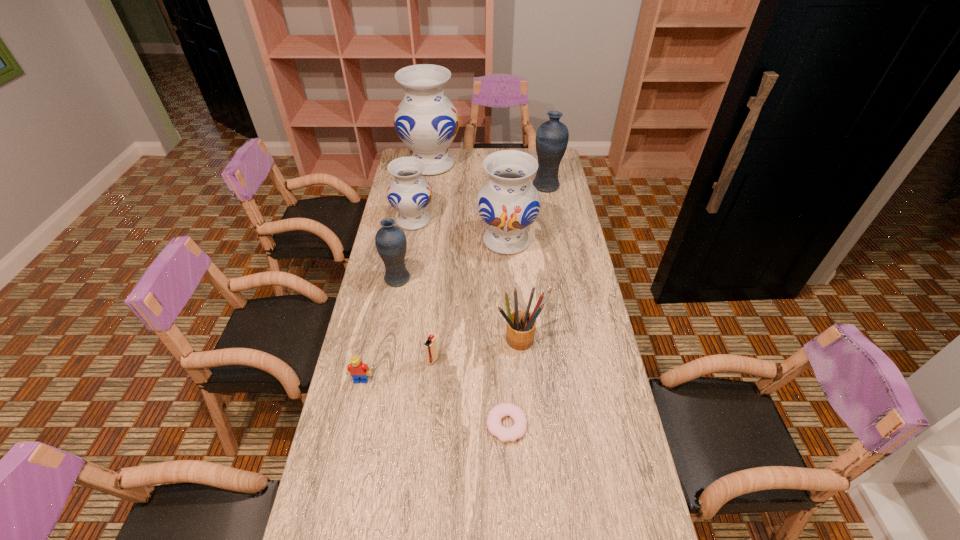
Where is `vacant region at the left edge of the desktop`? This screenshot has height=540, width=960. vacant region at the left edge of the desktop is located at coordinates (411, 255).

In the image, there is a desktop. Where is `free space at the right edge`? free space at the right edge is located at coordinates (597, 452).

Where is `free space between the pencil box and the smallest red vase`? The height and width of the screenshot is (540, 960). free space between the pencil box and the smallest red vase is located at coordinates (467, 280).

Identify the location of free space between the tallest object and the fourth vase from left to right. The height and width of the screenshot is (540, 960). (468, 202).

Where is `free spot between the second nearest object and the left blue vase`? This screenshot has height=540, width=960. free spot between the second nearest object and the left blue vase is located at coordinates (379, 329).

This screenshot has height=540, width=960. What are the coordinates of `free space between the shortest object and the farther blue vase` in the screenshot? It's located at (526, 305).

The image size is (960, 540). I want to click on vacant region between the right blue vase and the red Lego, so click(x=454, y=283).

At what (x,y) coordinates should I click in order to perform the action: click on free spot between the shortest object and the smallest red vase. Please return your answer as a coordinate pair (x, y). This screenshot has width=960, height=540. Looking at the image, I should click on (460, 322).

The height and width of the screenshot is (540, 960). In order to click on object that stands as the eighth closest to the second smallest red vase in this screenshot , I will do `click(517, 430)`.

Identify which object is located as the sixth nearest to the shortest object. Please provide its 2D coordinates. Your answer should be formatted as a tuple, i.e. [(x, y)], where the tuple contains the x and y coordinates of a point satisfying the conditions above.

[(410, 194)]